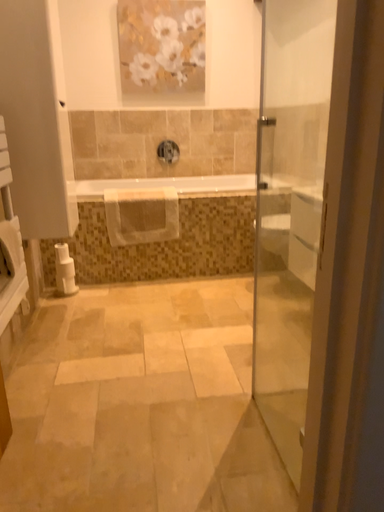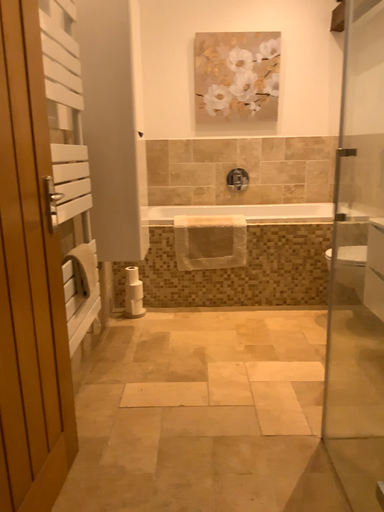
Question: How did the camera likely rotate when shooting the video?

Choices:
 (A) rotated left
 (B) rotated right

Answer: (A)